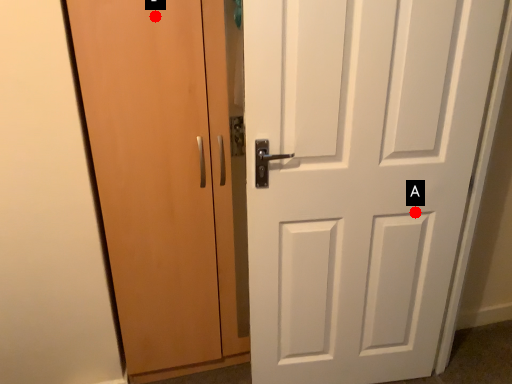
Question: Two points are circled on the image, labeled by A and B beside each circle. Which point appears closest to the camera in this image?

Choices:
 (A) A is closer
 (B) B is closer

Answer: (B)